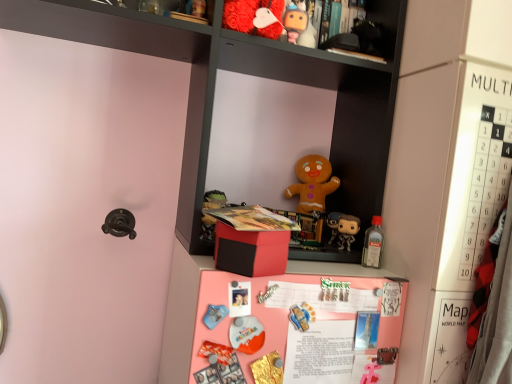
Question: In the image, is matte gingerbread man at center, which ranks as the 3th toy in top-to-bottom order, on the left side or the right side of translucent plastic bottle at upper right, placed as the fifth toy when sorted from front to back?

Choices:
 (A) left
 (B) right

Answer: (A)

Question: Is matte gingerbread man at center, the 7th toy from the front, wider or thinner than translucent plastic bottle at upper right, the 5th toy when ordered from top to bottom?

Choices:
 (A) wide
 (B) thin

Answer: (A)

Question: Which is farther from the matte gingerbread man at center, acting as the fifth toy starting from the bottom?

Choices:
 (A) matte plastic figurine at upper center, the sixth toy from the bottom
 (B) matte orange plush toy at center, arranged as the 6th toy when viewed from the top
 (C) matte black figurine at center-right, the sixth toy from the front
 (D) pink matte board at center
 (E) matte black cabinet at upper center

Answer: (B)

Question: Estimate the real-world distances between objects in this image. Which object is farther from the translucent plastic bottle at upper right, placed as the fifth toy when sorted from front to back?

Choices:
 (A) pink matte board at center
 (B) matte black cabinet at upper center
 (C) matte orange plush toy at center, the 7th toy from the back
 (D) metallic silver toy at center, the 5th toy in the back-to-front sequence
 (E) matte plastic figurine at upper center, the fourth toy from the front

Answer: (E)